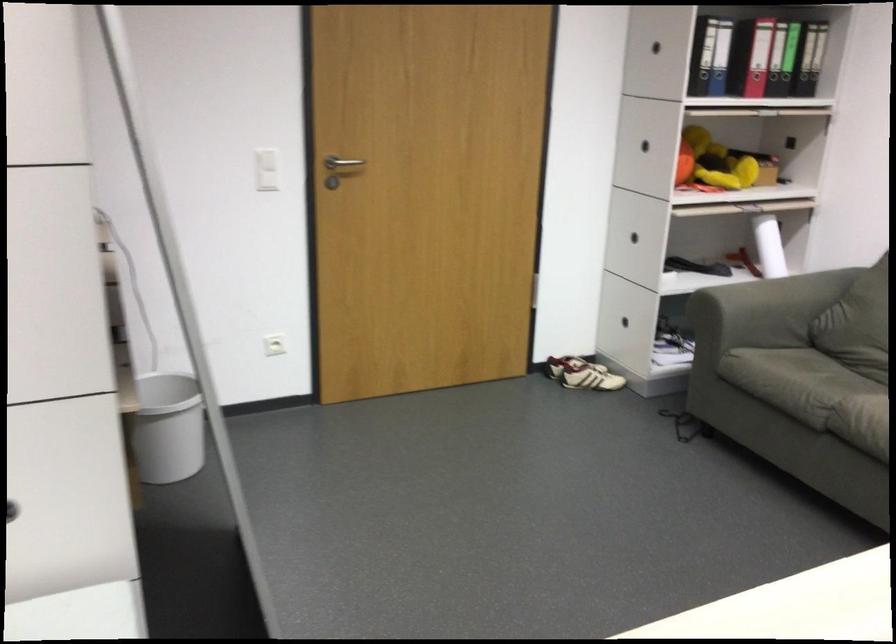
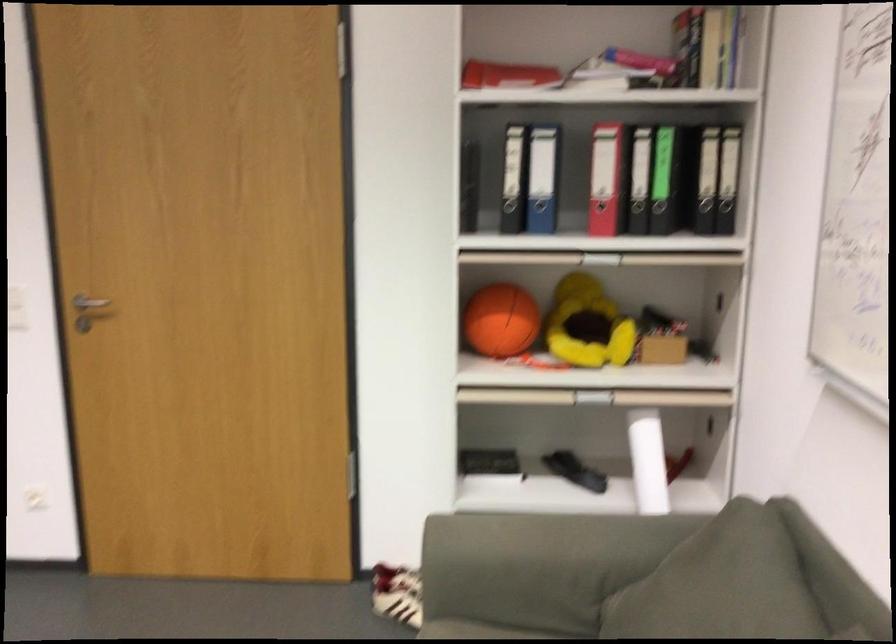
The point at (822, 70) is marked in the first image. Where is the corresponding point in the second image?

(734, 214)